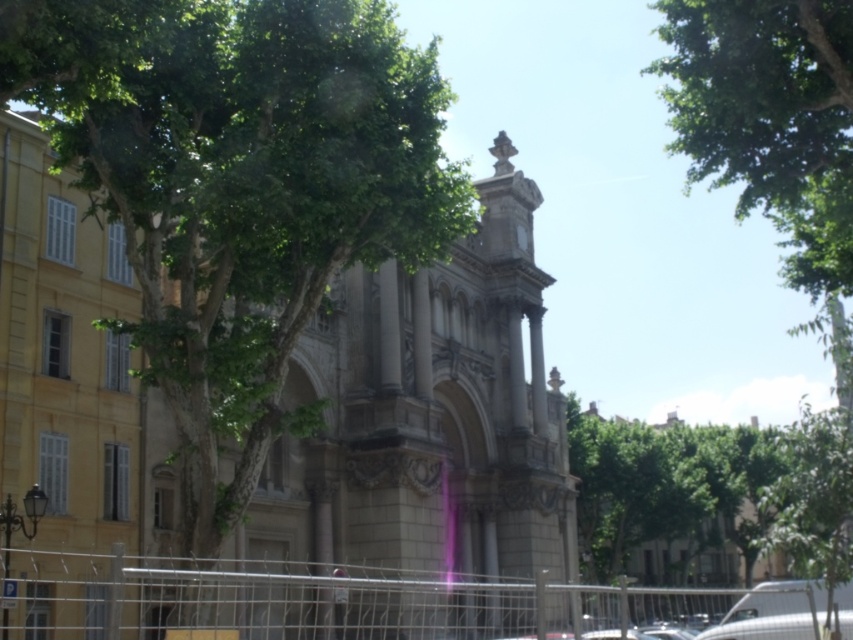
You are standing in front of the historic building and want to take a photo that includes both the green leafy tree at center and the green leafy tree at upper right. Which tree should you position closer to the camera to ensure both are fully visible in the frame?

You should position the green leafy tree at center closer to the camera because it has a lesser width compared to the green leafy tree at upper right, allowing both trees to fit within the frame without overlapping or being cut off.

You are standing in front of the historic building and see two points marked on the ground. The first point is at coordinate point (126, 244) and the second is at point (781, 227). From your perspective, which point is closer to you?

Point (126, 244) is in front of point (781, 227), so it is closer to you.

You are standing in front of the historic building and notice the metallic wire fence at lower center and the green leafy tree at upper right. From your perspective, which object is positioned to the left of the other?

The metallic wire fence at lower center is to the left of the green leafy tree at upper right.